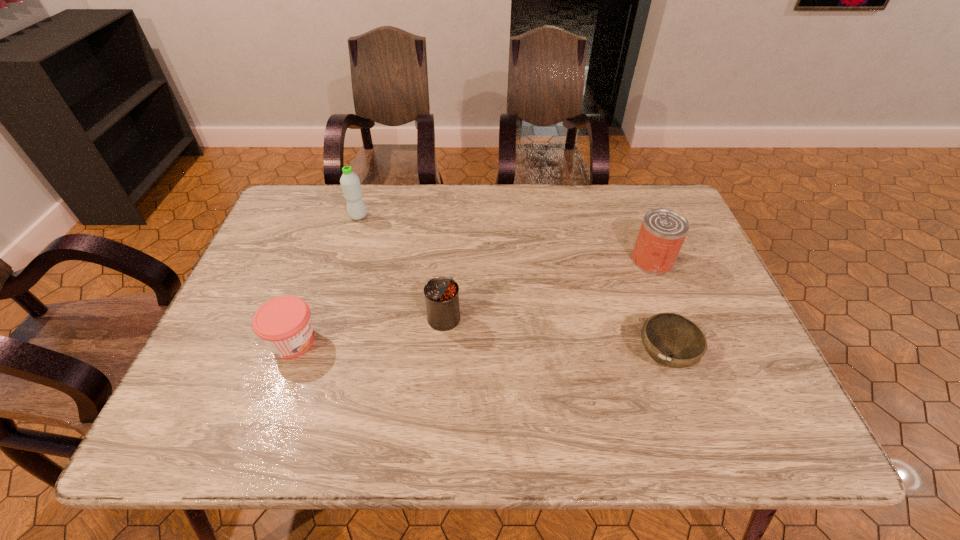
You are a GUI agent. You are given a task and a screenshot of the screen. Output one action in this format:
    pyautogui.click(x=<x>, y=<y>)
    Task: Click on the vacant area that lies between the jam and the fourth nearest object
    This screenshot has height=540, width=960.
    Given the screenshot: What is the action you would take?
    pyautogui.click(x=472, y=301)

The image size is (960, 540). Find the location of `object that stands as the third closest to the left can`. object that stands as the third closest to the left can is located at coordinates (672, 340).

Identify the location of object that ranks as the closest to the farther can. (672, 340).

Identify the location of vacant space that satisfies the following two spatial constraints: 1. on the front side of the water bottle; 2. on the front label of the fourth tallest object. (320, 341).

Locate an element on the screen. The image size is (960, 540). vacant point that satisfies the following two spatial constraints: 1. on the front side of the tallest object; 2. on the right side of the nearer can is located at coordinates (327, 318).

The width and height of the screenshot is (960, 540). Find the location of `free point that satisfies the following two spatial constraints: 1. on the back side of the fourth nearest object; 2. on the left side of the bowl`. free point that satisfies the following two spatial constraints: 1. on the back side of the fourth nearest object; 2. on the left side of the bowl is located at coordinates (631, 261).

Image resolution: width=960 pixels, height=540 pixels. I want to click on free spot that satisfies the following two spatial constraints: 1. on the back side of the bowl; 2. on the front label of the fourth tallest object, so click(x=659, y=341).